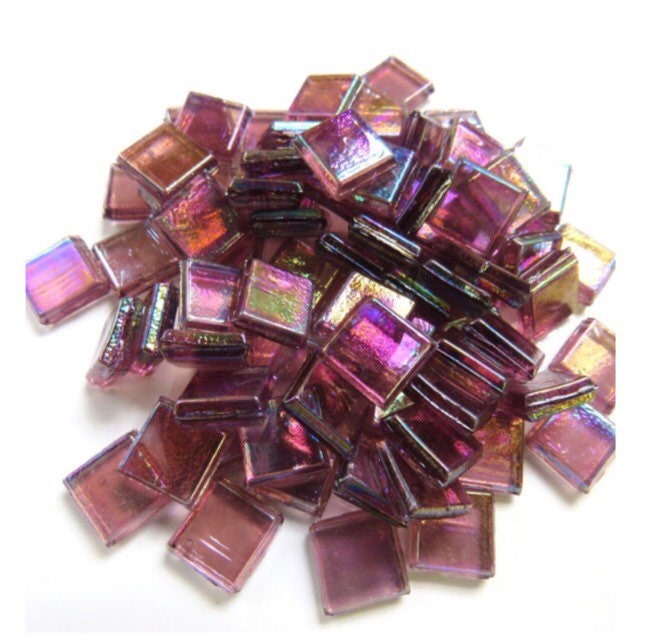
The width and height of the screenshot is (657, 642). I want to click on translucent pink square tiles, so click(x=118, y=494), click(x=217, y=526), click(x=166, y=449), click(x=461, y=542), click(x=574, y=442), click(x=60, y=278), click(x=478, y=214).